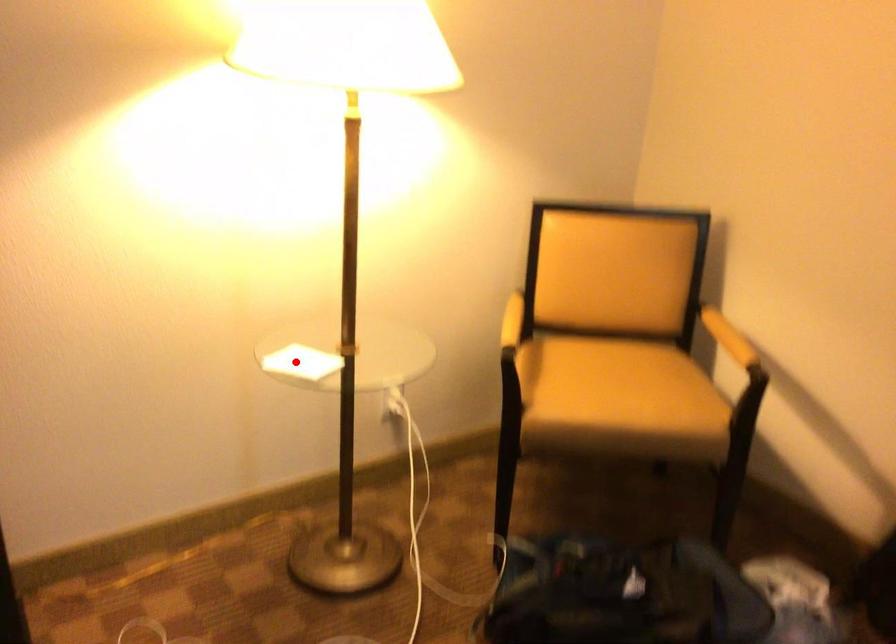
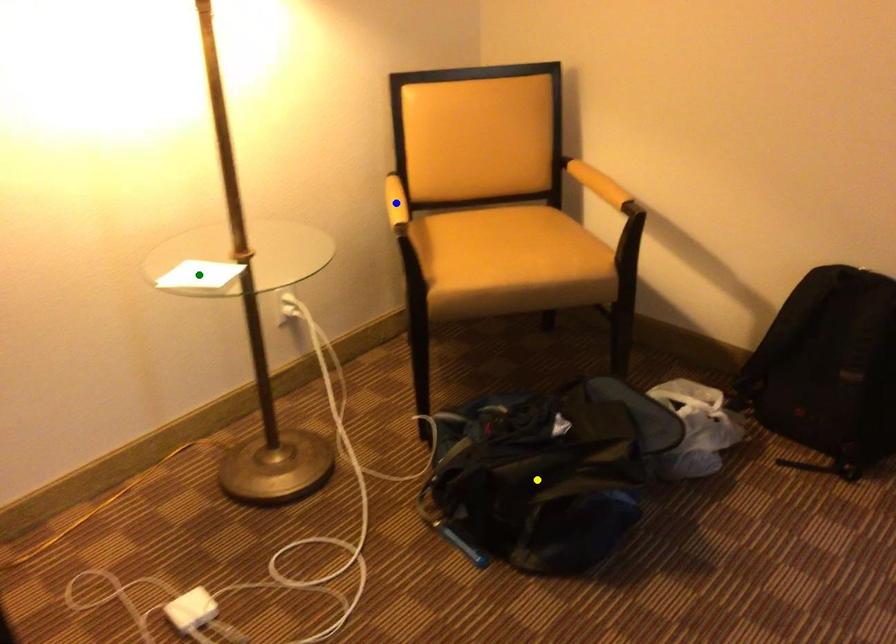
Question: I am providing you with two images of the same scene from different viewpoints. A red point is marked on the first image. You are given multiple points on the second image. Can you choose the point in image 2 that corresponds to the point in image 1?

Choices:
 (A) green point
 (B) yellow point
 (C) blue point

Answer: (A)